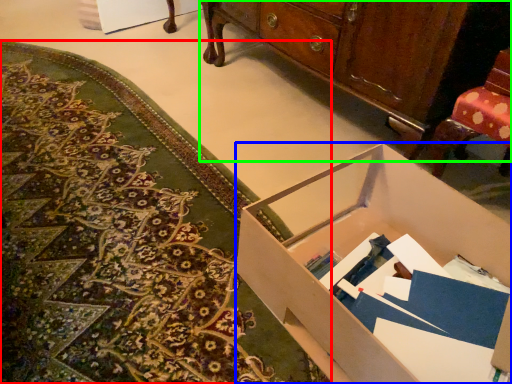
Question: Based on their relative distances, which object is farther from mat (highlighted by a red box)? Choose from desk (highlighted by a blue box) and cabinetry (highlighted by a green box).

Choices:
 (A) desk
 (B) cabinetry

Answer: (B)